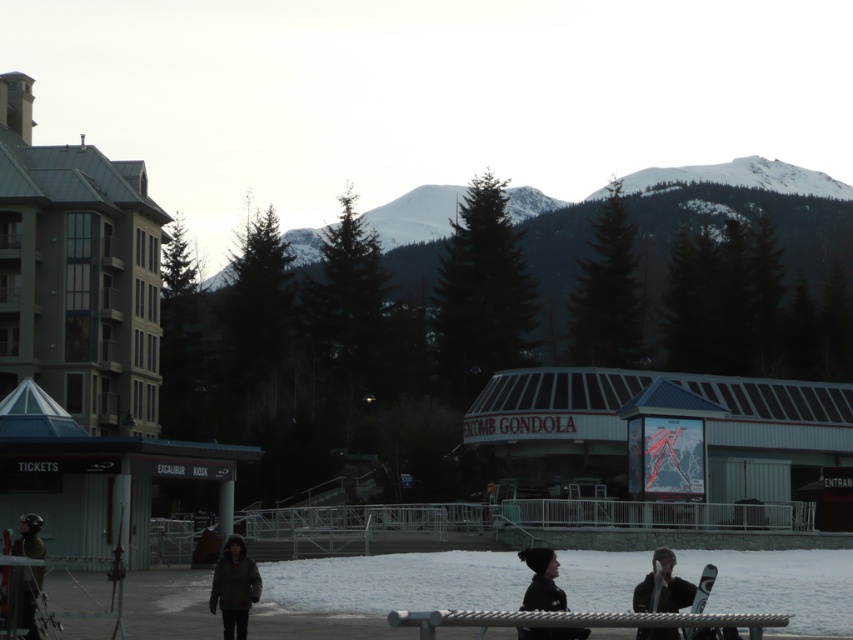
Question: Is silver metallic bench at lower center wider than green fabric jacket at lower left?

Choices:
 (A) no
 (B) yes

Answer: (A)

Question: Does green fabric jacket at lower left have a lesser width compared to black matte jacket at lower center?

Choices:
 (A) yes
 (B) no

Answer: (B)

Question: Which point is farther from the camera taking this photo?

Choices:
 (A) (549, 566)
 (B) (242, 593)

Answer: (B)

Question: Which object is positioned farthest from the silver metallic bench at lower center?

Choices:
 (A) dark brown jacket at lower center
 (B) white corrugated metal ski resort at center
 (C) black matte jacket at lower center

Answer: (B)

Question: Which point appears closest to the camera in this image?

Choices:
 (A) (734, 388)
 (B) (409, 616)

Answer: (B)

Question: Can you confirm if green fabric jacket at lower left is positioned to the left of black matte jacket at lower center?

Choices:
 (A) no
 (B) yes

Answer: (B)